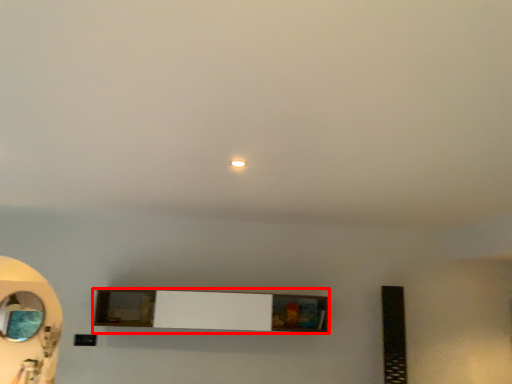
Question: Observing the image, what is the correct spatial positioning of shelf (annotated by the red box) in reference to mirror?

Choices:
 (A) right
 (B) left

Answer: (A)